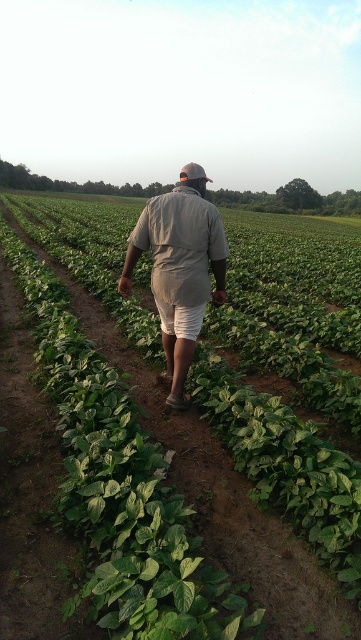
Question: Can you confirm if green leafy plant at center is thinner than khaki fabric shirt at center?

Choices:
 (A) yes
 (B) no

Answer: (B)

Question: Does green leafy plant at center appear under khaki fabric shirt at center?

Choices:
 (A) yes
 (B) no

Answer: (B)

Question: From the image, what is the correct spatial relationship of green leafy plant at center in relation to khaki fabric shirt at center?

Choices:
 (A) above
 (B) below

Answer: (A)

Question: Which object appears farthest from the camera in this image?

Choices:
 (A) green leafy plant at center
 (B) khaki fabric shirt at center

Answer: (B)

Question: Which point is closer to the camera?

Choices:
 (A) green leafy plant at center
 (B) khaki fabric shirt at center

Answer: (A)